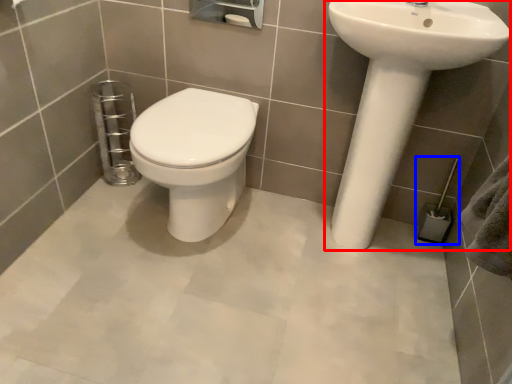
Question: Which of the following is the farthest to the observer, sink (highlighted by a red box) or towel bar (highlighted by a blue box)?

Choices:
 (A) sink
 (B) towel bar

Answer: (B)